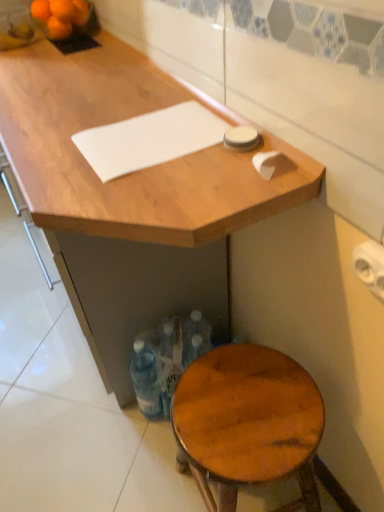
Question: Looking at the image, does orange matte tangerine at upper left, which is the first tangerine from front to back, seem bigger or smaller compared to translucent plastic bottles at lower center?

Choices:
 (A) big
 (B) small

Answer: (B)

Question: Visually, is orange matte tangerine at upper left, the 4th tangerine positioned from the back, positioned to the left or to the right of translucent plastic bottles at lower center?

Choices:
 (A) left
 (B) right

Answer: (A)

Question: Which object is positioned closest to the orange matte tangerine at upper left, the fourth tangerine in the front-to-back sequence?

Choices:
 (A) orange matte tangerine at upper left, the 4th tangerine positioned from the back
 (B) orange matte at upper left
 (C) orange matte tangerine at upper left, the 3th tangerine positioned from the front
 (D) wooden stool at lower right
 (E) orange matte tangerine at upper left, the 2th tangerine from the front

Answer: (A)

Question: Estimate the real-world distances between objects in this image. Which object is closer to the translucent plastic bottles at lower center?

Choices:
 (A) white matte cutting board at upper center
 (B) white paper towel at upper right
 (C) wooden desk at center
 (D) orange matte tangerine at upper left, which is the first tangerine from front to back
 (E) orange matte tangerine at upper left, acting as the first tangerine starting from the back

Answer: (C)